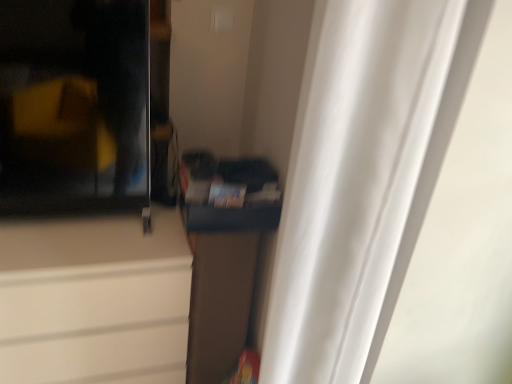
Question: Does white sheer curtain at right come in front of transparent glass screen door at upper left?

Choices:
 (A) no
 (B) yes

Answer: (B)

Question: Considering the relative sizes of white sheer curtain at right and transparent glass screen door at upper left in the image provided, is white sheer curtain at right thinner than transparent glass screen door at upper left?

Choices:
 (A) yes
 (B) no

Answer: (B)

Question: From the image's perspective, is white sheer curtain at right below transparent glass screen door at upper left?

Choices:
 (A) no
 (B) yes

Answer: (B)

Question: Would you say transparent glass screen door at upper left is part of white sheer curtain at right's contents?

Choices:
 (A) yes
 (B) no

Answer: (B)

Question: Can you confirm if white sheer curtain at right is wider than transparent glass screen door at upper left?

Choices:
 (A) yes
 (B) no

Answer: (A)

Question: Which is correct: white sheer curtain at right is inside matte white cabinet at left, which ranks as the second cabinetry in right-to-left order, or outside of it?

Choices:
 (A) inside
 (B) outside

Answer: (B)

Question: Considering the positions of white sheer curtain at right and matte white cabinet at left, which ranks as the second cabinetry in right-to-left order, in the image, is white sheer curtain at right bigger or smaller than matte white cabinet at left, which ranks as the second cabinetry in right-to-left order,?

Choices:
 (A) small
 (B) big

Answer: (A)

Question: From a real-world perspective, is white sheer curtain at right physically located above or below matte white cabinet at left, which ranks as the second cabinetry in right-to-left order?

Choices:
 (A) above
 (B) below

Answer: (A)

Question: From the image's perspective, relative to matte white cabinet at left, acting as the first cabinetry starting from the left, is white sheer curtain at right above or below?

Choices:
 (A) below
 (B) above

Answer: (B)

Question: Does point (366, 362) appear closer or farther from the camera than point (8, 157)?

Choices:
 (A) farther
 (B) closer

Answer: (B)

Question: From a real-world perspective, is white sheer curtain at right physically located above or below transparent glass screen door at upper left?

Choices:
 (A) above
 (B) below

Answer: (B)

Question: Is white sheer curtain at right taller or shorter than transparent glass screen door at upper left?

Choices:
 (A) tall
 (B) short

Answer: (A)

Question: Is white sheer curtain at right wider or thinner than transparent glass screen door at upper left?

Choices:
 (A) thin
 (B) wide

Answer: (B)

Question: In terms of width, does transparent glass screen door at upper left look wider or thinner when compared to white sheer curtain at right?

Choices:
 (A) wide
 (B) thin

Answer: (B)

Question: Is transparent glass screen door at upper left inside or outside of white sheer curtain at right?

Choices:
 (A) outside
 (B) inside

Answer: (A)